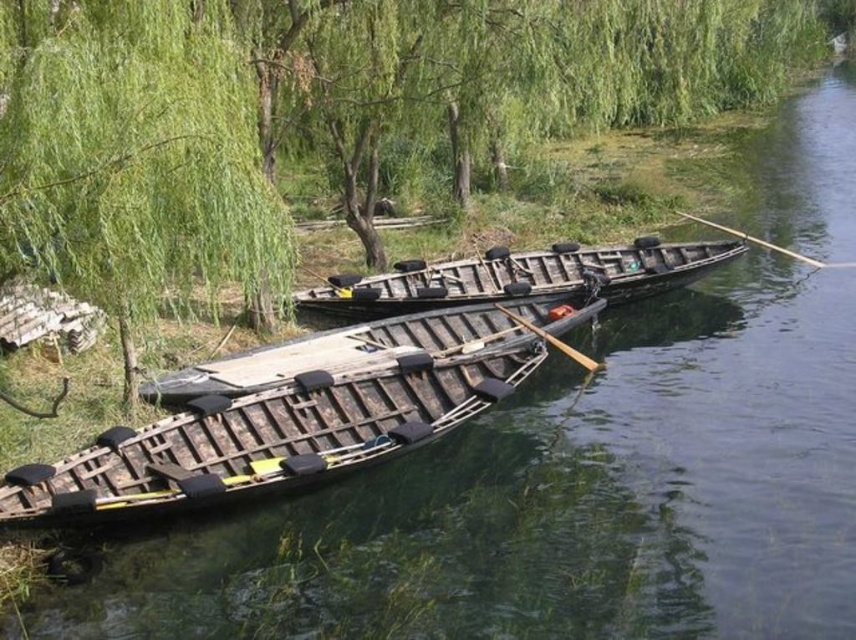
Question: Which object is closer to the camera taking this photo?

Choices:
 (A) wooden boat at center
 (B) wooden smooth paddle at right
 (C) green leafy willow at upper left
 (D) wooden paddle at center

Answer: (C)

Question: Does wooden canoe at center appear on the left side of wooden smooth paddle at right?

Choices:
 (A) no
 (B) yes

Answer: (B)

Question: Can you confirm if wooden boat at center is smaller than wooden canoe at center?

Choices:
 (A) no
 (B) yes

Answer: (B)

Question: Can you confirm if green leafy willow at upper left is positioned to the right of wooden canoe at center?

Choices:
 (A) no
 (B) yes

Answer: (A)

Question: Which of the following is the closest to the observer?

Choices:
 (A) wooden smooth paddle at right
 (B) wooden canoe at center
 (C) wooden paddle at center
 (D) wooden boat at center

Answer: (D)

Question: Estimate the real-world distances between objects in this image. Which object is closer to the wooden boat at center?

Choices:
 (A) wooden paddle at center
 (B) wooden smooth paddle at right

Answer: (A)